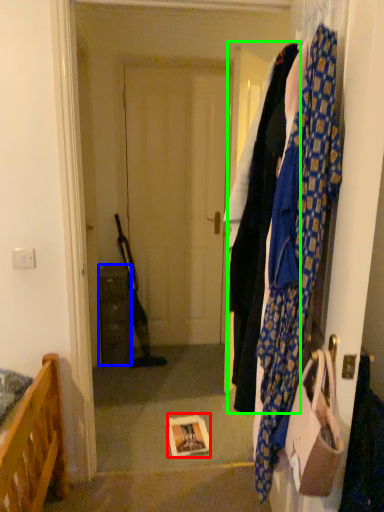
Question: Which object is positioned closest to book (highlighted by a red box)? Select from cabinetry (highlighted by a blue box) and clothing (highlighted by a green box).

Choices:
 (A) cabinetry
 (B) clothing

Answer: (B)